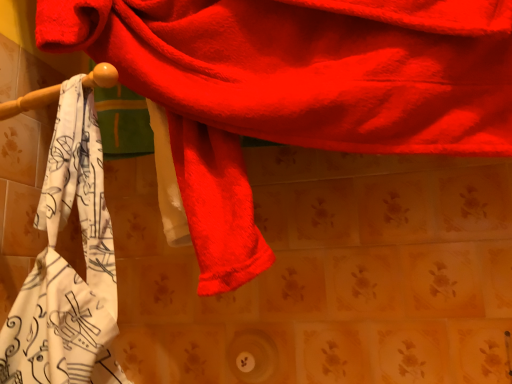
In order to click on white printed towel at left, which appears as the 1th towel when viewed from the left in this screenshot , I will do `click(68, 265)`.

In order to face white printed towel at left, which appears as the 1th towel when viewed from the left, should I rotate leftwards or rightwards?

Turn left approximately 24.217 degrees to face it.

What is the approximate height of white printed towel at left, positioned as the second towel in right-to-left order?

white printed towel at left, positioned as the second towel in right-to-left order, is 37.96 centimeters tall.

Describe the element at coordinates (68, 265) in the screenshot. The image size is (512, 384). I see `white printed towel at left, positioned as the second towel in right-to-left order` at that location.

The height and width of the screenshot is (384, 512). Identify the location of fluffy red towel at upper center, which ranks as the 1th towel in right-to-left order. (296, 89).

Describe the element at coordinates (296, 89) in the screenshot. The height and width of the screenshot is (384, 512). I see `fluffy red towel at upper center, which is the 2th towel from left to right` at that location.

This screenshot has height=384, width=512. What are the coordinates of `white printed towel at left, which appears as the 1th towel when viewed from the left` in the screenshot? It's located at (68, 265).

Considering the relative positions of fluffy red towel at upper center, which ranks as the 1th towel in right-to-left order, and white printed towel at left, which appears as the 1th towel when viewed from the left, in the image provided, is fluffy red towel at upper center, which ranks as the 1th towel in right-to-left order, to the left of white printed towel at left, which appears as the 1th towel when viewed from the left, from the viewer's perspective?

No, fluffy red towel at upper center, which ranks as the 1th towel in right-to-left order, is not to the left of white printed towel at left, which appears as the 1th towel when viewed from the left.

Is fluffy red towel at upper center, which ranks as the 1th towel in right-to-left order, closer to camera compared to white printed towel at left, which appears as the 1th towel when viewed from the left?

That is True.

Considering the positions of point (268, 2) and point (48, 342), is point (268, 2) closer or farther from the camera than point (48, 342)?

Point (268, 2) is positioned farther from the camera compared to point (48, 342).

From the image's perspective, is fluffy red towel at upper center, which ranks as the 1th towel in right-to-left order, over white printed towel at left, positioned as the second towel in right-to-left order?

Yes, from the image's perspective, fluffy red towel at upper center, which ranks as the 1th towel in right-to-left order, is above white printed towel at left, positioned as the second towel in right-to-left order.

From a real-world perspective, does fluffy red towel at upper center, which is the 2th towel from left to right, sit lower than white printed towel at left, positioned as the second towel in right-to-left order?

Actually, fluffy red towel at upper center, which is the 2th towel from left to right, is physically above white printed towel at left, positioned as the second towel in right-to-left order, in the real world.

Which of these two, fluffy red towel at upper center, which ranks as the 1th towel in right-to-left order, or white printed towel at left, which appears as the 1th towel when viewed from the left, is thinner?

fluffy red towel at upper center, which ranks as the 1th towel in right-to-left order, is thinner.

In terms of height, does fluffy red towel at upper center, which is the 2th towel from left to right, look taller or shorter compared to white printed towel at left, which appears as the 1th towel when viewed from the left?

fluffy red towel at upper center, which is the 2th towel from left to right, is taller than white printed towel at left, which appears as the 1th towel when viewed from the left.

Is fluffy red towel at upper center, which ranks as the 1th towel in right-to-left order, bigger than white printed towel at left, which appears as the 1th towel when viewed from the left?

Indeed, fluffy red towel at upper center, which ranks as the 1th towel in right-to-left order, has a larger size compared to white printed towel at left, which appears as the 1th towel when viewed from the left.

Is fluffy red towel at upper center, which is the 2th towel from left to right, positioned beyond the bounds of white printed towel at left, positioned as the second towel in right-to-left order?

Yes, fluffy red towel at upper center, which is the 2th towel from left to right, is outside of white printed towel at left, positioned as the second towel in right-to-left order.

Is fluffy red towel at upper center, which ranks as the 1th towel in right-to-left order, positioned far away from white printed towel at left, positioned as the second towel in right-to-left order?

fluffy red towel at upper center, which ranks as the 1th towel in right-to-left order, is near white printed towel at left, positioned as the second towel in right-to-left order, not far away.

In the scene shown: Is fluffy red towel at upper center, which is the 2th towel from left to right, aimed at white printed towel at left, which appears as the 1th towel when viewed from the left?

Yes, fluffy red towel at upper center, which is the 2th towel from left to right, is aimed at white printed towel at left, which appears as the 1th towel when viewed from the left.

Measure the distance between fluffy red towel at upper center, which is the 2th towel from left to right, and white printed towel at left, which appears as the 1th towel when viewed from the left.

fluffy red towel at upper center, which is the 2th towel from left to right, is 8.13 inches away from white printed towel at left, which appears as the 1th towel when viewed from the left.

In the image, there is a white printed towel at left, which appears as the 1th towel when viewed from the left. Where is `towel above it (from the image's perspective)`? towel above it (from the image's perspective) is located at coordinates (296, 89).

Can you confirm if white printed towel at left, which appears as the 1th towel when viewed from the left, is positioned to the right of fluffy red towel at upper center, which ranks as the 1th towel in right-to-left order?

No, white printed towel at left, which appears as the 1th towel when viewed from the left, is not to the right of fluffy red towel at upper center, which ranks as the 1th towel in right-to-left order.

In the image, is white printed towel at left, positioned as the second towel in right-to-left order, positioned in front of or behind fluffy red towel at upper center, which is the 2th towel from left to right?

white printed towel at left, positioned as the second towel in right-to-left order, is behind fluffy red towel at upper center, which is the 2th towel from left to right.

Which is behind, point (60, 160) or point (416, 70)?

Point (60, 160)

In the scene shown: From the image's perspective, which one is positioned higher, white printed towel at left, positioned as the second towel in right-to-left order, or fluffy red towel at upper center, which ranks as the 1th towel in right-to-left order?

fluffy red towel at upper center, which ranks as the 1th towel in right-to-left order, from the image's perspective.

From a real-world perspective, which is physically below, white printed towel at left, which appears as the 1th towel when viewed from the left, or fluffy red towel at upper center, which is the 2th towel from left to right?

From a 3D spatial view, white printed towel at left, which appears as the 1th towel when viewed from the left, is below.

In terms of width, does white printed towel at left, which appears as the 1th towel when viewed from the left, look wider or thinner when compared to fluffy red towel at upper center, which ranks as the 1th towel in right-to-left order?

In the image, white printed towel at left, which appears as the 1th towel when viewed from the left, appears to be wider than fluffy red towel at upper center, which ranks as the 1th towel in right-to-left order.

Is white printed towel at left, which appears as the 1th towel when viewed from the left, taller or shorter than fluffy red towel at upper center, which ranks as the 1th towel in right-to-left order?

Considering their sizes, white printed towel at left, which appears as the 1th towel when viewed from the left, has less height than fluffy red towel at upper center, which ranks as the 1th towel in right-to-left order.

Based on the photo, who is smaller, white printed towel at left, positioned as the second towel in right-to-left order, or fluffy red towel at upper center, which is the 2th towel from left to right?

white printed towel at left, positioned as the second towel in right-to-left order, is smaller.

Is fluffy red towel at upper center, which is the 2th towel from left to right, surrounded by white printed towel at left, positioned as the second towel in right-to-left order?

No, fluffy red towel at upper center, which is the 2th towel from left to right, is located outside of white printed towel at left, positioned as the second towel in right-to-left order.

Is white printed towel at left, which appears as the 1th towel when viewed from the left, next to fluffy red towel at upper center, which ranks as the 1th towel in right-to-left order?

white printed towel at left, which appears as the 1th towel when viewed from the left, and fluffy red towel at upper center, which ranks as the 1th towel in right-to-left order, are clearly separated.

Is white printed towel at left, which appears as the 1th towel when viewed from the left, looking in the opposite direction of fluffy red towel at upper center, which is the 2th towel from left to right?

Absolutely, white printed towel at left, which appears as the 1th towel when viewed from the left, is directed away from fluffy red towel at upper center, which is the 2th towel from left to right.

What's the angular difference between white printed towel at left, which appears as the 1th towel when viewed from the left, and fluffy red towel at upper center, which is the 2th towel from left to right,'s facing directions?

15.8 degrees.

Could you measure the distance between white printed towel at left, which appears as the 1th towel when viewed from the left, and fluffy red towel at upper center, which is the 2th towel from left to right?

The distance of white printed towel at left, which appears as the 1th towel when viewed from the left, from fluffy red towel at upper center, which is the 2th towel from left to right, is 20.65 centimeters.

Locate an element on the screen. This screenshot has width=512, height=384. towel on the left side of fluffy red towel at upper center, which ranks as the 1th towel in right-to-left order is located at coordinates (68, 265).

At what (x,y) coordinates should I click in order to perform the action: click on towel on the left of the fluffy red towel at upper center, which ranks as the 1th towel in right-to-left order. Please return your answer as a coordinate pair (x, y). Looking at the image, I should click on (68, 265).

Where is `towel above the white printed towel at left, which appears as the 1th towel when viewed from the left (from a real-world perspective)`? towel above the white printed towel at left, which appears as the 1th towel when viewed from the left (from a real-world perspective) is located at coordinates (296, 89).